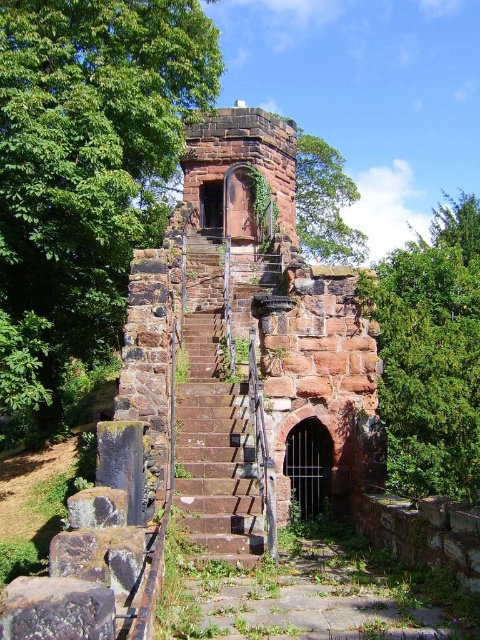
Question: Is green leafy tree at right closer to the viewer compared to brown stone stairs at center?

Choices:
 (A) no
 (B) yes

Answer: (A)

Question: Which point appears farthest from the camera in this image?

Choices:
 (A) (188, 58)
 (B) (471, 380)
 (C) (222, 304)
 (D) (203, 364)

Answer: (A)

Question: Among these objects, which one is nearest to the camera?

Choices:
 (A) green leafy tree at right
 (B) green leafy tree at upper left
 (C) green leafy tree at upper center
 (D) brown stone stairs at center

Answer: (D)

Question: Does green leafy tree at right appear on the left side of green leafy tree at upper center?

Choices:
 (A) no
 (B) yes

Answer: (A)

Question: Which is farther from the reddish-brown stone stairs at center?

Choices:
 (A) green leafy tree at right
 (B) green leafy tree at upper center

Answer: (B)

Question: Is the position of green leafy tree at upper left more distant than that of green leafy tree at right?

Choices:
 (A) no
 (B) yes

Answer: (B)